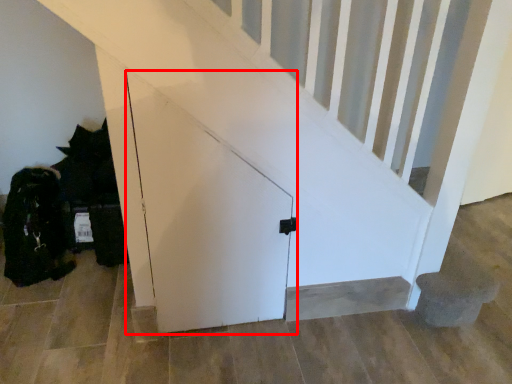
Question: In this image, where is door (annotated by the red box) located relative to stairwell?

Choices:
 (A) left
 (B) right

Answer: (A)